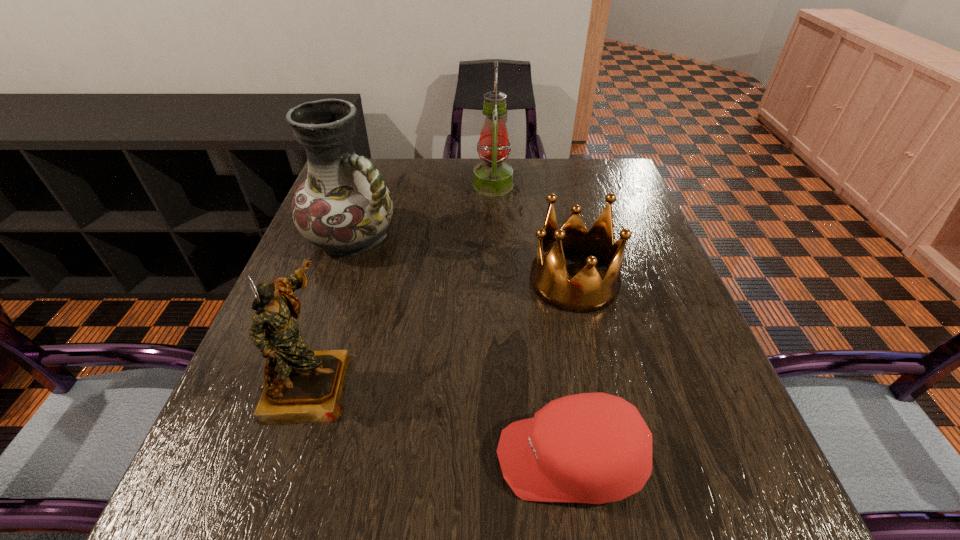
Locate an element on the screen. The height and width of the screenshot is (540, 960). the farthest object is located at coordinates (493, 177).

Locate an element on the screen. vase is located at coordinates (344, 206).

This screenshot has width=960, height=540. I want to click on figurine, so click(x=301, y=385).

This screenshot has width=960, height=540. Identify the location of the second shortest object. point(586,292).

Find the location of a particular element. The image size is (960, 540). cap is located at coordinates (595, 448).

The image size is (960, 540). I want to click on free spot located on the front of the farthest object, so click(x=495, y=232).

You are a GUI agent. You are given a task and a screenshot of the screen. Output one action in this format:
    pyautogui.click(x=<x>, y=<y>)
    Task: Click on the vacant space located on the right of the vase
    The width and height of the screenshot is (960, 540).
    Given the screenshot: What is the action you would take?
    pyautogui.click(x=461, y=238)

Where is `vacant space located 0.310m on the front-facing side of the third tallest object`? vacant space located 0.310m on the front-facing side of the third tallest object is located at coordinates (520, 383).

Locate an element on the screen. The width and height of the screenshot is (960, 540). vacant area situated 0.400m on the back of the crown is located at coordinates (549, 170).

Identify the location of blank space located 0.210m on the front-facing side of the shortest object. Image resolution: width=960 pixels, height=540 pixels. (364, 458).